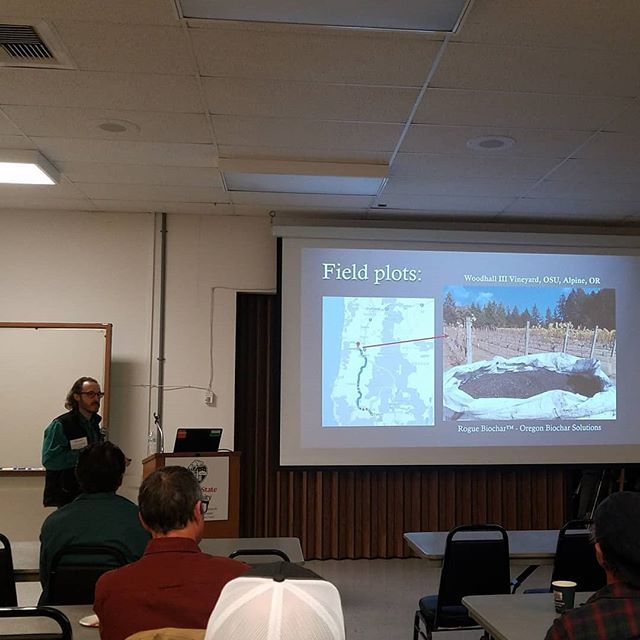
Find the location of a particular element. The height and width of the screenshot is (640, 640). laptop is located at coordinates (200, 440).